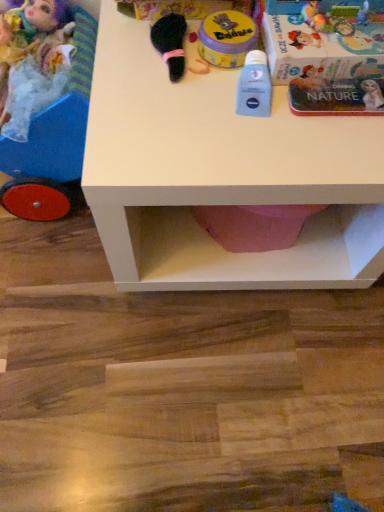
Question: Is matte plastic doll carriage at left, which is the 2th toy in left-to-right order, with blue matte lotion at center, which appears as the fourth toy when viewed from the left?

Choices:
 (A) yes
 (B) no

Answer: (B)

Question: Is matte plastic doll carriage at left, which is the 2th toy in left-to-right order, positioned behind blue matte lotion at center, which appears as the fourth toy when viewed from the left?

Choices:
 (A) no
 (B) yes

Answer: (A)

Question: From a real-world perspective, does matte plastic doll carriage at left, which is the 2th toy in left-to-right order, stand above blue matte lotion at center, which appears as the fourth toy when viewed from the left?

Choices:
 (A) yes
 (B) no

Answer: (B)

Question: Is matte plastic doll carriage at left, which is the 2th toy in left-to-right order, outside of blue matte lotion at center, which appears as the fourth toy when viewed from the left?

Choices:
 (A) yes
 (B) no

Answer: (A)

Question: Can you confirm if matte plastic doll carriage at left, placed as the 3th toy when sorted from right to left, is positioned to the left of blue matte lotion at center, the 1th toy viewed from the right?

Choices:
 (A) no
 (B) yes

Answer: (B)

Question: From the image's perspective, is matte plastic doll carriage at left, placed as the 3th toy when sorted from right to left, above blue matte lotion at center, the 1th toy viewed from the right?

Choices:
 (A) no
 (B) yes

Answer: (B)

Question: Would you say metallic silver book at upper right is outside matte plastic doll carriage at left, which is the 2th toy in left-to-right order?

Choices:
 (A) no
 (B) yes

Answer: (B)

Question: Can you confirm if metallic silver book at upper right is thinner than matte plastic doll carriage at left, placed as the 3th toy when sorted from right to left?

Choices:
 (A) no
 (B) yes

Answer: (B)

Question: Does metallic silver book at upper right appear on the left side of matte plastic doll carriage at left, which is the 2th toy in left-to-right order?

Choices:
 (A) no
 (B) yes

Answer: (A)

Question: Is metallic silver book at upper right not close to matte plastic doll carriage at left, placed as the 3th toy when sorted from right to left?

Choices:
 (A) yes
 (B) no

Answer: (B)

Question: Is metallic silver book at upper right bigger than matte plastic doll carriage at left, placed as the 3th toy when sorted from right to left?

Choices:
 (A) no
 (B) yes

Answer: (A)

Question: From the image's perspective, does metallic silver book at upper right appear lower than matte plastic doll carriage at left, which is the 2th toy in left-to-right order?

Choices:
 (A) no
 (B) yes

Answer: (A)

Question: From the image's perspective, is yellow matte container at upper center, positioned as the third toy in left-to-right order, on metallic silver book at upper right?

Choices:
 (A) yes
 (B) no

Answer: (B)